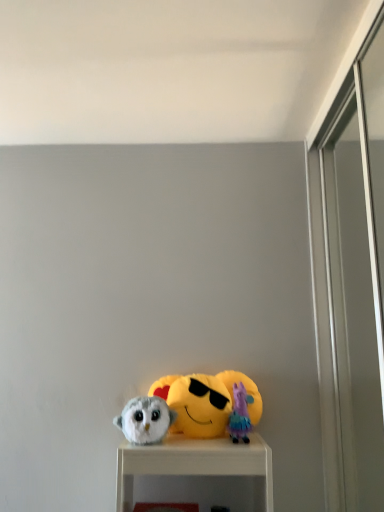
Question: From a real-world perspective, is fluffy white owl at lower left, which is the first toy from left to right, above or below plush purple at center, the first toy viewed from the right?

Choices:
 (A) above
 (B) below

Answer: (B)

Question: Is fluffy white owl at lower left, the second toy when ordered from right to left, bigger or smaller than plush purple at center, the first toy viewed from the right?

Choices:
 (A) big
 (B) small

Answer: (A)

Question: Which object is the farthest from the plush purple at center, marked as the second toy in a left-to-right arrangement?

Choices:
 (A) yellow plush at center
 (B) fluffy white owl at lower left, the second toy when ordered from right to left

Answer: (B)

Question: Which object is the closest to the fluffy white owl at lower left, the second toy when ordered from right to left?

Choices:
 (A) yellow plush at center
 (B) plush purple at center, marked as the second toy in a left-to-right arrangement

Answer: (A)